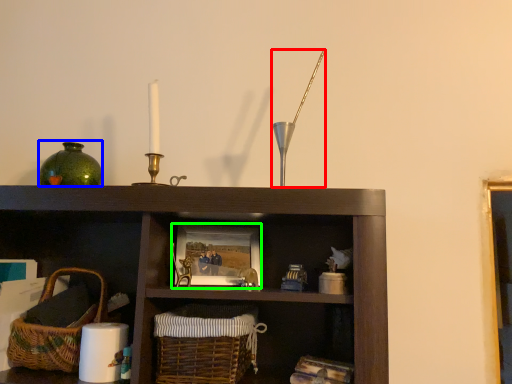
Question: Based on their relative distances, which object is farther from candle holder (highlighted by a red box)? Choose from glass vase (highlighted by a blue box) and picture frame (highlighted by a green box).

Choices:
 (A) glass vase
 (B) picture frame

Answer: (A)